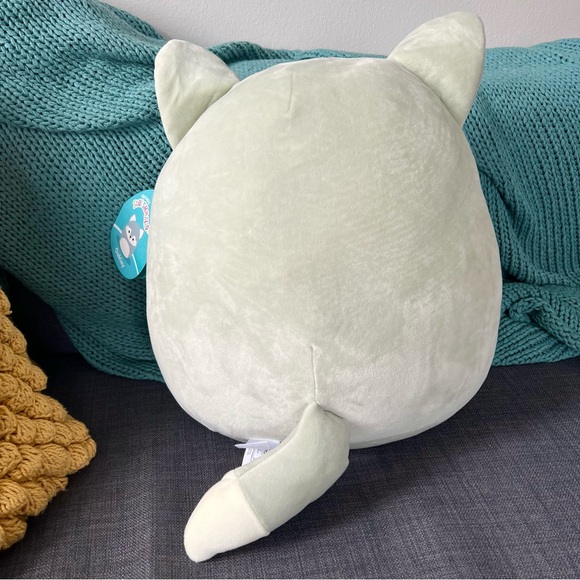
The image size is (580, 580). Find the location of `plushy`. plushy is located at coordinates (340, 191).